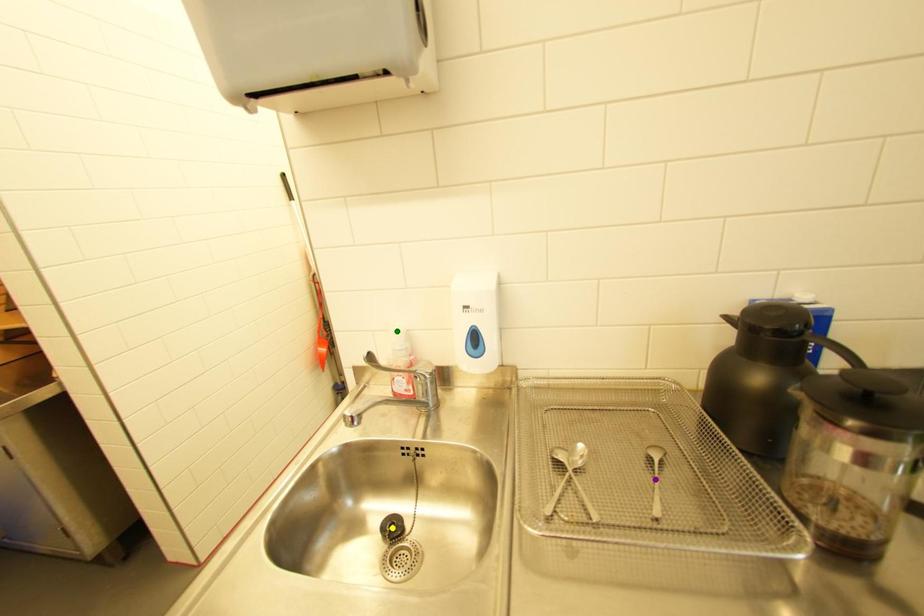
Order these from farthest to nearest:
green point, yellow point, purple point

green point
yellow point
purple point